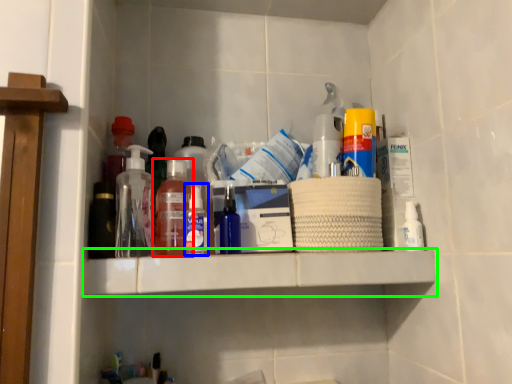
Question: Based on their relative distances, which object is nearer to bottle (highlighted by a red box)? Choose from bottle (highlighted by a blue box) and shelf (highlighted by a green box).

Choices:
 (A) bottle
 (B) shelf

Answer: (A)